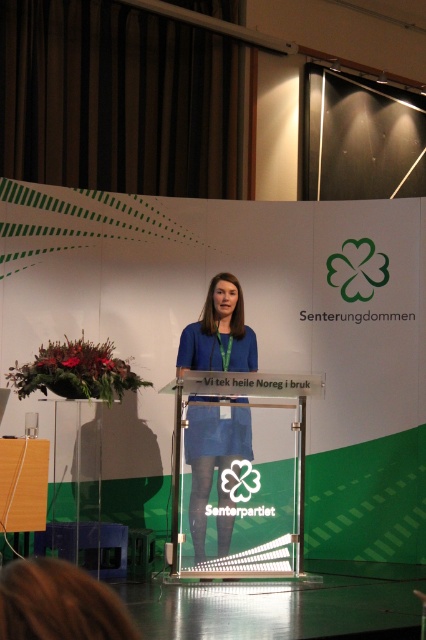
You are a photographer setting up for a formal event. You need to position a light source so that it illuminates both the transparent glass podium at center and the blue fabric dress at center without causing glare on the podium. Based on their positions, where should you place the light relative to the podium and the dress?

Since the transparent glass podium at center is on the right side of the blue fabric dress at center, you should place the light source to the left of the podium. This way, the light will hit the podium from the side, reducing glare, while still reaching the dress positioned to the left.

Consider the image. You are standing at the entrance of the event hall and want to approach the transparent glass podium at center. Based on its 2D coordinates, in which general direction should you walk from your current position?

The transparent glass podium at center is located at coordinates approximately 0.741 on the x axis and 0.561 on the y axis. Since you are at the entrance, which is typically positioned at the lower left corner of a room, you should walk towards the upper right direction to reach the transparent glass podium at center.

You are a photographer positioned at the back of the room. You want to capture a photo that includes both the transparent glass podium at center and the blue fabric dress at center. Given that your camera has a minimum focus distance of 5 inches, will you be able to focus on both objects simultaneously?

The transparent glass podium at center and blue fabric dress at center are 5.60 inches apart from each other. Since the distance between them is greater than the camera minimum focus distance of 5 inches, the photographer can focus on both objects simultaneously.